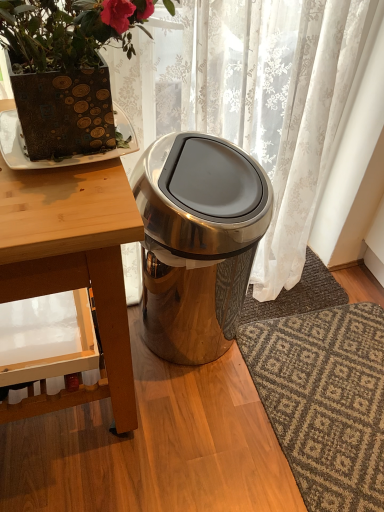
Where is `vacant region in front of brown textured plate at upper left`? The height and width of the screenshot is (512, 384). vacant region in front of brown textured plate at upper left is located at coordinates (67, 203).